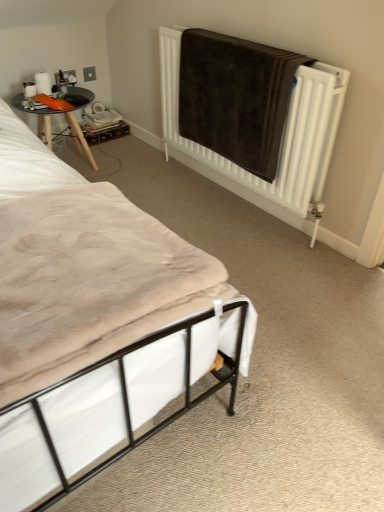
Where is `free point in front of brown towel at upper right`? The height and width of the screenshot is (512, 384). free point in front of brown towel at upper right is located at coordinates (262, 266).